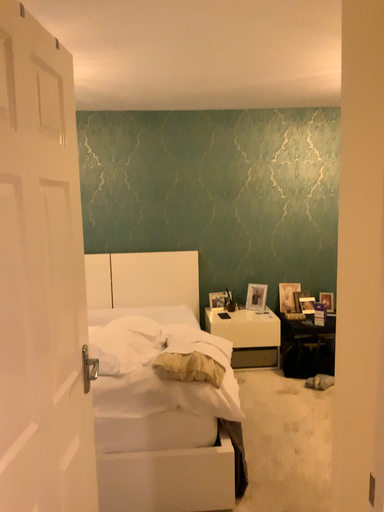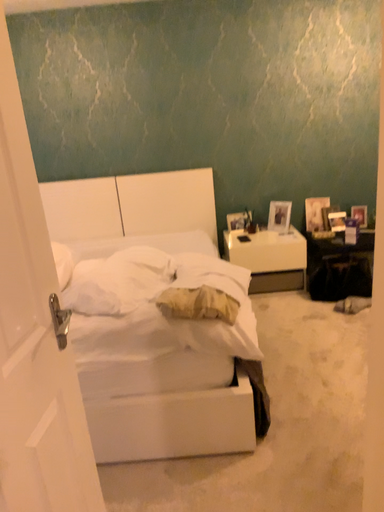
Question: How did the camera likely rotate when shooting the video?

Choices:
 (A) rotated upward
 (B) rotated downward

Answer: (B)